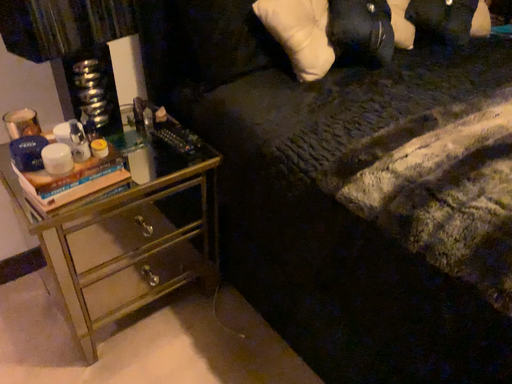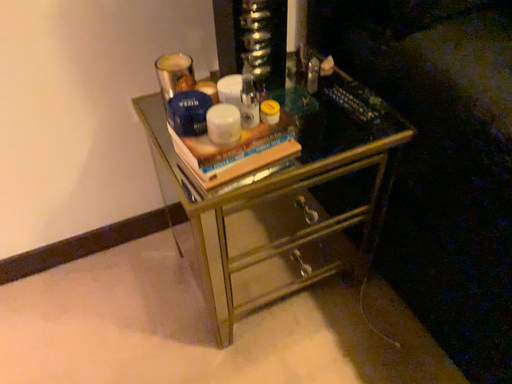
Question: Which way did the camera rotate in the video?

Choices:
 (A) rotated downward
 (B) rotated upward

Answer: (A)